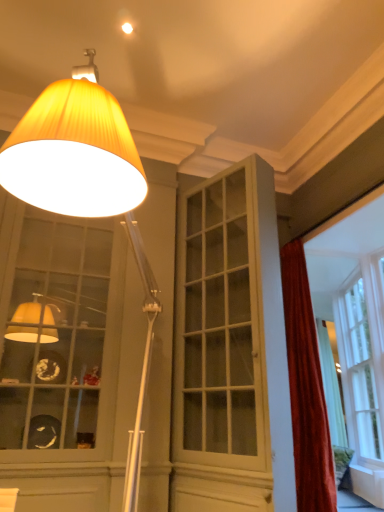
Question: Can you confirm if matte yellow fabric lampshade at upper left is thinner than velvet red curtain at right?

Choices:
 (A) no
 (B) yes

Answer: (A)

Question: Is matte yellow fabric lampshade at upper left further to camera compared to velvet red curtain at right?

Choices:
 (A) no
 (B) yes

Answer: (A)

Question: From the image's perspective, is matte yellow fabric lampshade at upper left under velvet red curtain at right?

Choices:
 (A) yes
 (B) no

Answer: (B)

Question: Is velvet red curtain at right a part of matte yellow fabric lampshade at upper left?

Choices:
 (A) yes
 (B) no

Answer: (B)

Question: Would you consider matte yellow fabric lampshade at upper left to be distant from velvet red curtain at right?

Choices:
 (A) yes
 (B) no

Answer: (A)

Question: Does matte yellow fabric lampshade at upper left turn towards velvet red curtain at right?

Choices:
 (A) no
 (B) yes

Answer: (A)

Question: Is white glossy cabinet at center a part of matte yellow fabric lampshade at upper left?

Choices:
 (A) yes
 (B) no

Answer: (B)

Question: Is matte yellow fabric lampshade at upper left outside of white glossy cabinet at center?

Choices:
 (A) no
 (B) yes

Answer: (B)

Question: From the image's perspective, does matte yellow fabric lampshade at upper left appear higher than white glossy cabinet at center?

Choices:
 (A) no
 (B) yes

Answer: (B)

Question: Does matte yellow fabric lampshade at upper left come in front of white glossy cabinet at center?

Choices:
 (A) yes
 (B) no

Answer: (A)

Question: Does matte yellow fabric lampshade at upper left have a smaller size compared to white glossy cabinet at center?

Choices:
 (A) no
 (B) yes

Answer: (A)

Question: Is matte yellow fabric lampshade at upper left facing towards white glossy cabinet at center?

Choices:
 (A) no
 (B) yes

Answer: (A)

Question: Would you say white glossy cabinet at center is outside matte yellow fabric lampshade at upper left?

Choices:
 (A) no
 (B) yes

Answer: (B)